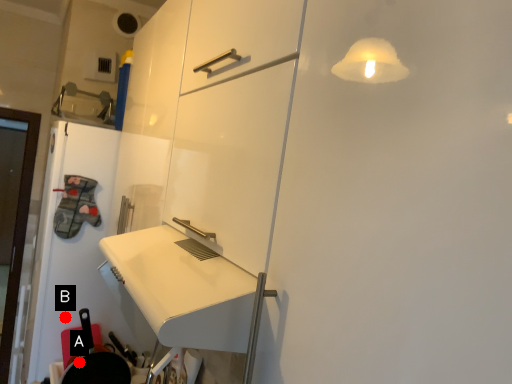
Question: Two points are circled on the image, labeled by A and B beside each circle. Which of the following is the closest to the observer?

Choices:
 (A) A is closer
 (B) B is closer

Answer: (A)